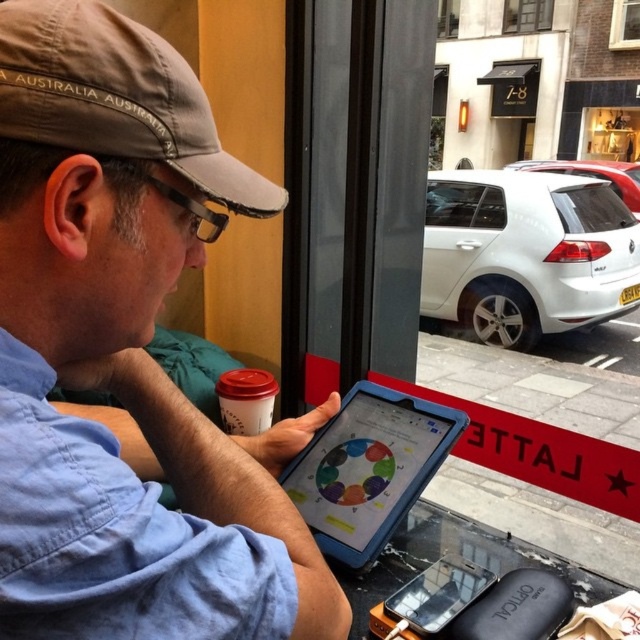
You are standing in front of the table in the cafe scene. There are two points marked on the table surface. The first point is at coordinates point (419, 477) and the second is at point (452, 10). Which point is closer to you?

Point (419, 477) is closer to the camera than point (452, 10), so the first point is closer to you.

You are a delivery person standing outside the cafe and need to hand over a package to the man inside. The clear glass window at upper center and transparent glass window at upper center are both in your line of sight. Which window should you approach to ensure the man can see you clearly?

Both the clear glass window at upper center and transparent glass window at upper center are located at the same position, so approaching either would allow the man to see you clearly since they are the same window.